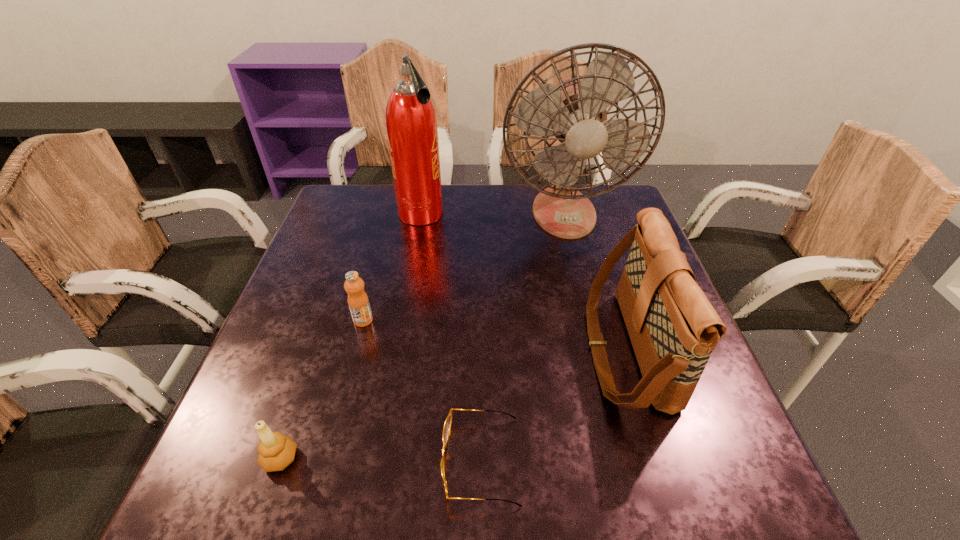
Identify the location of fan. (574, 111).

I want to click on fire extinguisher, so click(x=411, y=125).

In order to click on shoulder bag in this screenshot , I will do `click(673, 328)`.

Locate an element on the screen. The height and width of the screenshot is (540, 960). orange juice is located at coordinates (358, 301).

Locate an element on the screen. This screenshot has height=540, width=960. candle_holder is located at coordinates (276, 451).

Locate an element on the screen. This screenshot has height=540, width=960. the second shortest object is located at coordinates coord(276,451).

The width and height of the screenshot is (960, 540). In order to click on spectacles in this screenshot , I will do `click(448, 422)`.

At what (x,y) coordinates should I click in order to perform the action: click on free spot located 0.070m in front of the fan to direct airflow. Please return your answer as a coordinate pair (x, y). The image size is (960, 540). Looking at the image, I should click on (575, 259).

Locate an element on the screen. vacant space located 0.300m on the front of the fire extinguisher is located at coordinates (403, 314).

The image size is (960, 540). I want to click on vacant space located on the front-facing side of the shoulder bag, so pos(535,349).